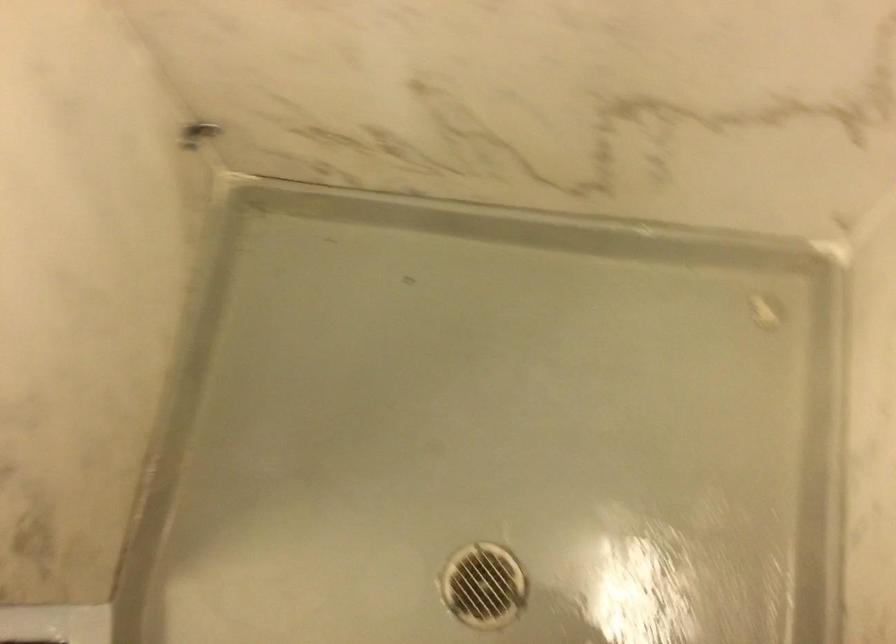
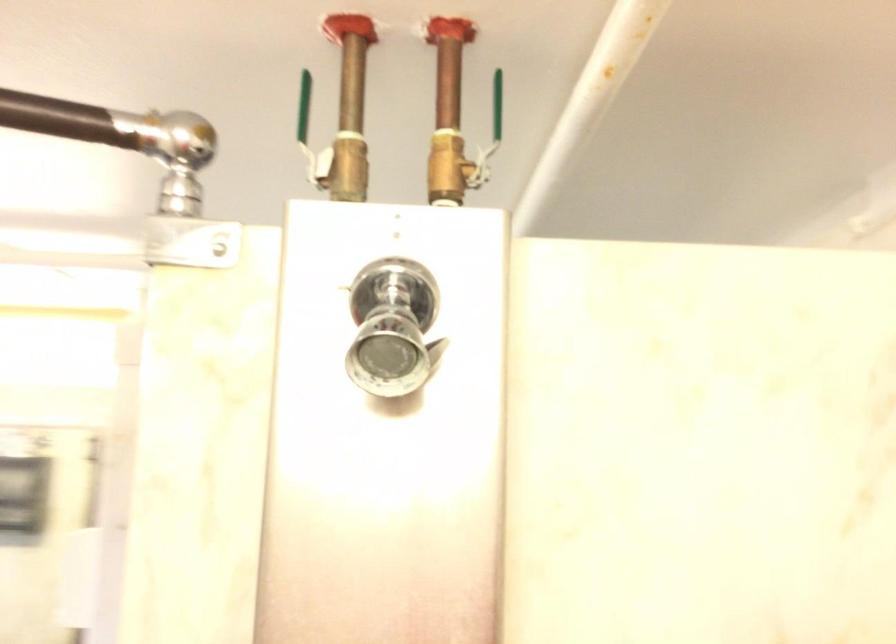
Question: The camera is either moving clockwise (left) or counter-clockwise (right) around the object. The first image is from the beginning of the video and the second image is from the end. Is the camera moving left or right when shooting the video?

Choices:
 (A) Left
 (B) Right

Answer: (B)